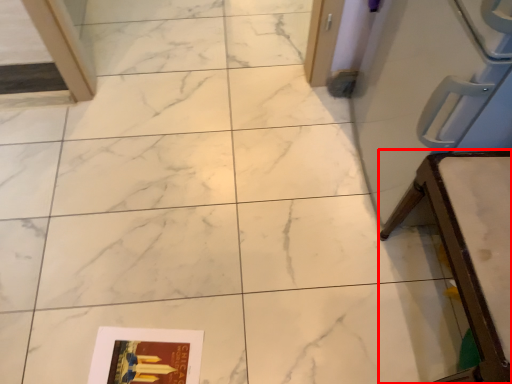
Question: Where is furniture (annotated by the red box) located in relation to magazine in the image?

Choices:
 (A) right
 (B) left

Answer: (A)